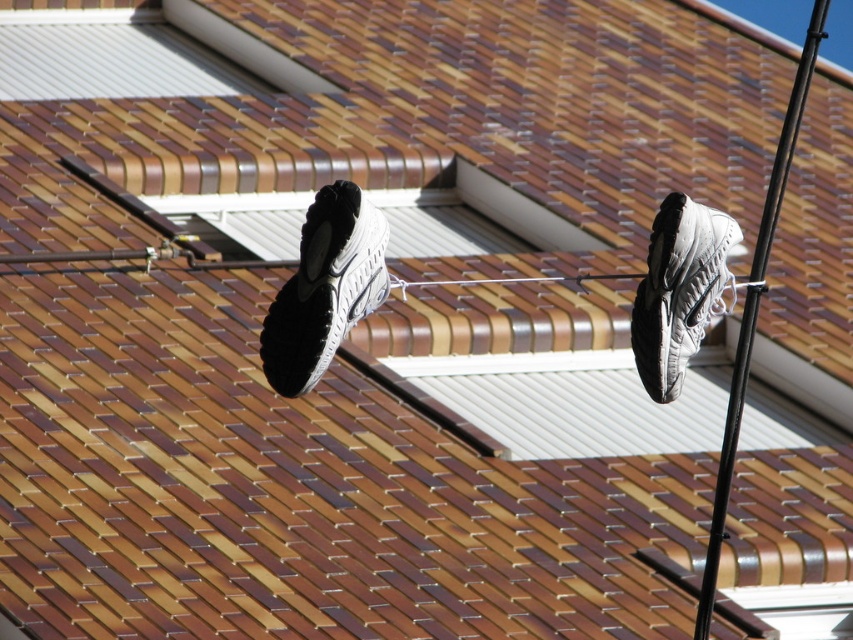
Does white matte shoe at center appear on the right side of gray fabric shoe at upper right?

No, white matte shoe at center is not to the right of gray fabric shoe at upper right.

Where is `white matte shoe at center`? Image resolution: width=853 pixels, height=640 pixels. white matte shoe at center is located at coordinates (325, 288).